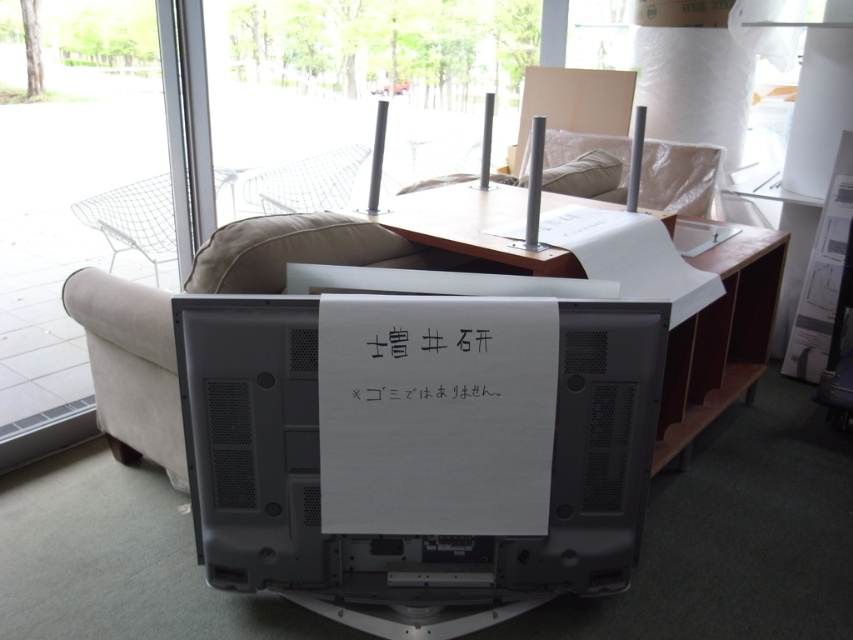
You are organizing a small event and need to place a decorative centerpiece between the wooden table at center and the white paper at center. According to the scene, where should you place it?

The wooden table at center is positioned on the right side of white paper at center, so the decorative centerpiece should be placed between them, ensuring it is centered between the two objects.

You are organizing a small meeting in the room and need to place a name tag on the table so that it is visible from the podium. The white paper at center and the clear wire mesh chair at center are both on the table. Which object should you place the name tag in front of to ensure it is visible from the podium?

The white paper at center is shorter than the clear wire mesh chair at center, so placing the name tag in front of the white paper at center ensures it will be visible from the podium as it won not be blocked by the taller chair.

You are organizing a small meeting in the room and need to place a 12 inch wide laptop on the table. The table has the white paper at center and the clear wire mesh chair at center on it. Which object can the laptop be placed on without exceeding its width?

The white paper at center has a lesser width compared to clear wire mesh chair at center. Since the laptop is 12 inches wide, it can be placed on the clear wire mesh chair at center as it is wider than the white paper at center.